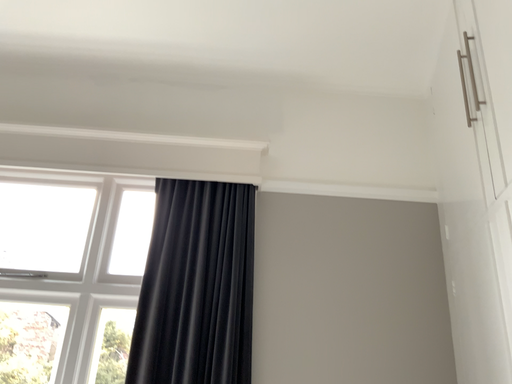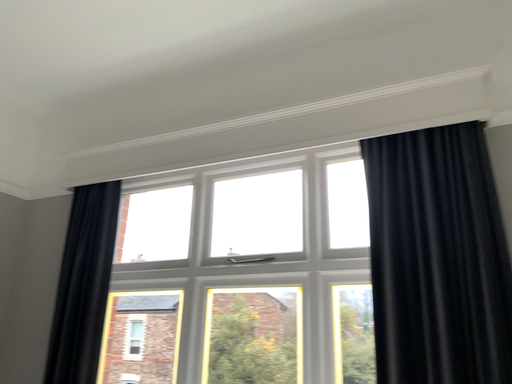
Question: How did the camera likely rotate when shooting the video?

Choices:
 (A) rotated left
 (B) rotated right

Answer: (A)